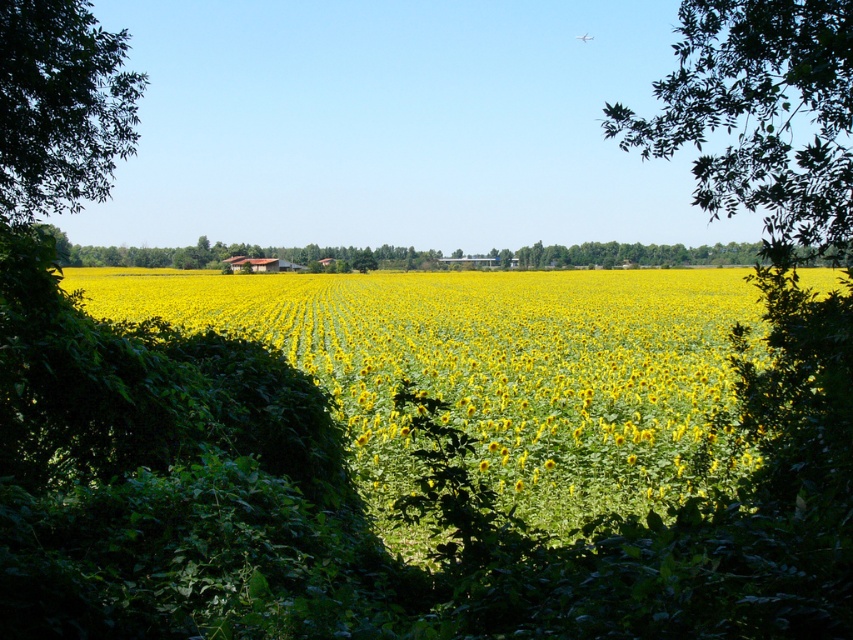
Question: Does green leafy tree at upper right come behind green leafy tree at left?

Choices:
 (A) yes
 (B) no

Answer: (B)

Question: Which point is closer to the camera?

Choices:
 (A) (778, 216)
 (B) (0, 68)

Answer: (A)

Question: Does yellow matte sunflower at center have a smaller size compared to green leafy tree at left?

Choices:
 (A) yes
 (B) no

Answer: (B)

Question: Observing the image, what is the correct spatial positioning of green leafy tree at upper right in reference to green leafy tree at left?

Choices:
 (A) above
 (B) below

Answer: (A)

Question: Among these points, which one is farthest from the camera?

Choices:
 (A) (32, 138)
 (B) (732, 33)
 (C) (564, 476)

Answer: (A)

Question: Which of the following is the closest to the observer?

Choices:
 (A) (567, 284)
 (B) (782, 45)
 (C) (33, 106)

Answer: (B)